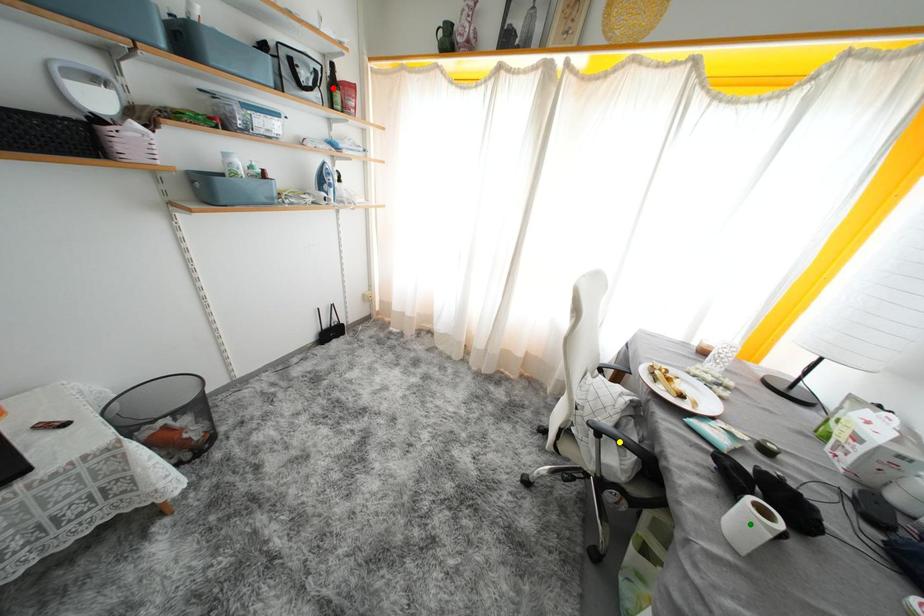
Order these from nearest to farthest:
yellow point | red point | green point

green point
yellow point
red point